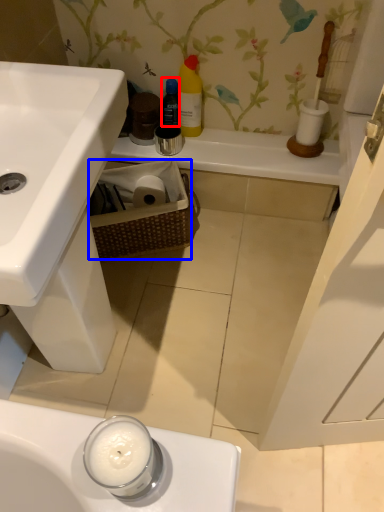
Question: Which object appears closest to the camera in this image, bottle (highlighted by a red box) or basket (highlighted by a blue box)?

Choices:
 (A) bottle
 (B) basket

Answer: (B)